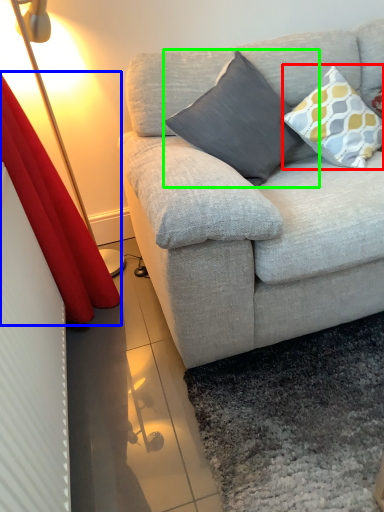
Question: Which object is the closest to the pillow (highlighted by a red box)? Choose among these: curtain (highlighted by a blue box) or pillow (highlighted by a green box).

Choices:
 (A) curtain
 (B) pillow

Answer: (B)